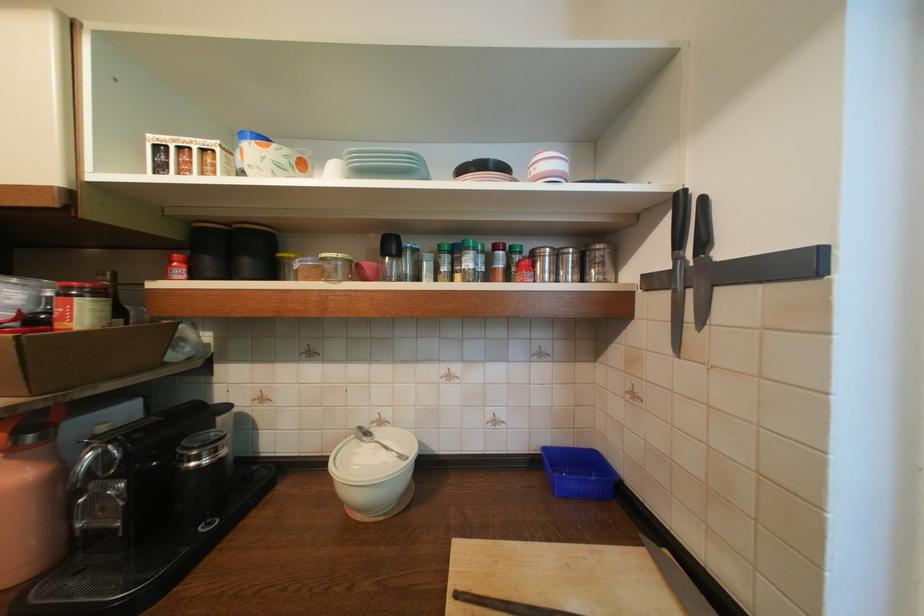
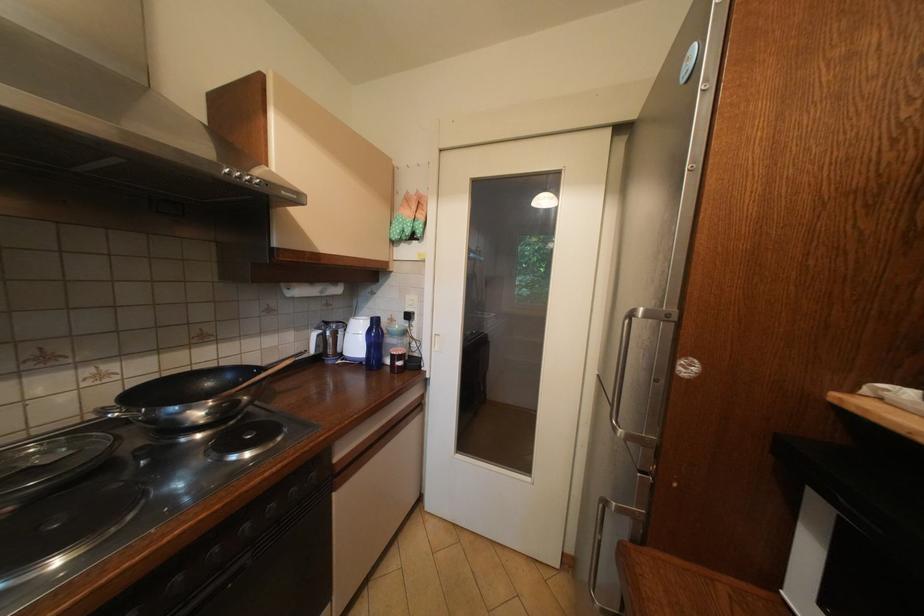
Question: How did the camera likely rotate?

Choices:
 (A) Left
 (B) Right
 (C) Up
 (D) Down

Answer: (A)